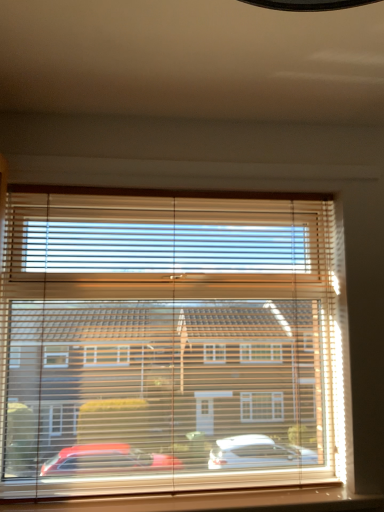
Question: In the image, is wooden at lower center positioned in front of or behind wooden blinds at center?

Choices:
 (A) front
 (B) behind

Answer: (A)

Question: From a real-world perspective, is wooden at lower center above or below wooden blinds at center?

Choices:
 (A) below
 (B) above

Answer: (A)

Question: In terms of size, does wooden at lower center appear bigger or smaller than wooden blinds at center?

Choices:
 (A) small
 (B) big

Answer: (A)

Question: From the image's perspective, is wooden blinds at center located above or below wooden at lower center?

Choices:
 (A) above
 (B) below

Answer: (A)

Question: Would you say wooden blinds at center is to the left or to the right of wooden at lower center in the picture?

Choices:
 (A) left
 (B) right

Answer: (A)

Question: Considering the positions of wooden blinds at center and wooden at lower center in the image, is wooden blinds at center wider or thinner than wooden at lower center?

Choices:
 (A) wide
 (B) thin

Answer: (B)

Question: From a real-world perspective, is wooden blinds at center positioned above or below wooden at lower center?

Choices:
 (A) below
 (B) above

Answer: (B)